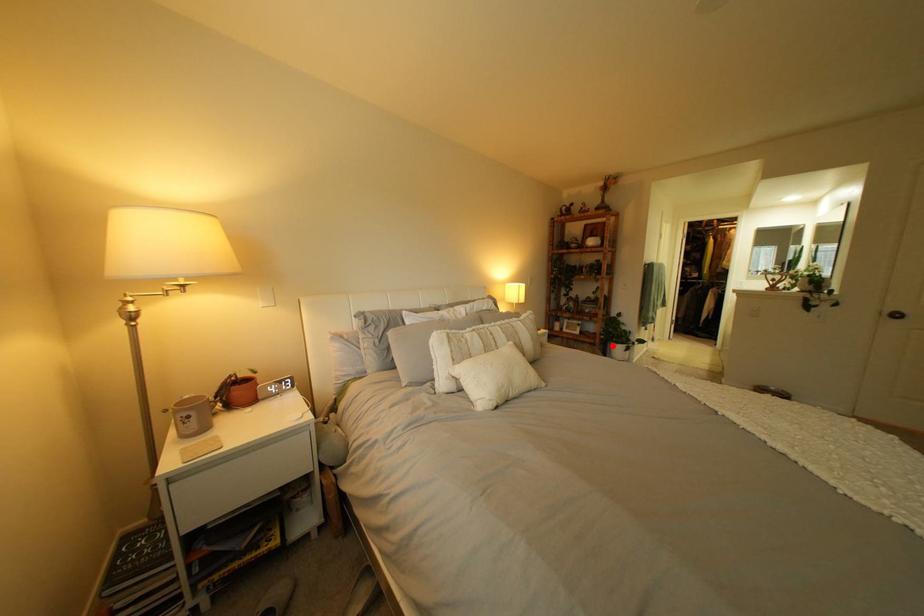
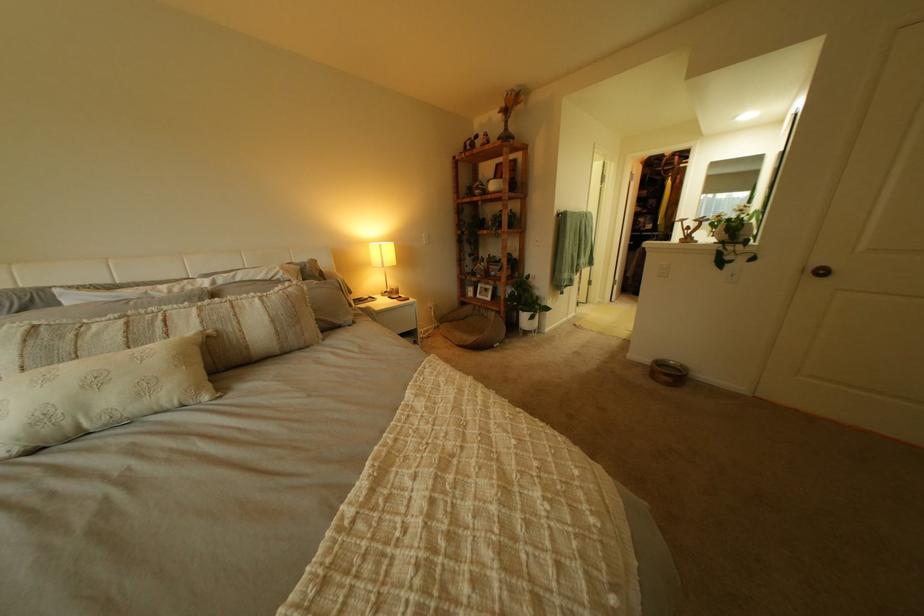
Find the pixel in the second image that matches the highlighted location in the first image.

(517, 314)